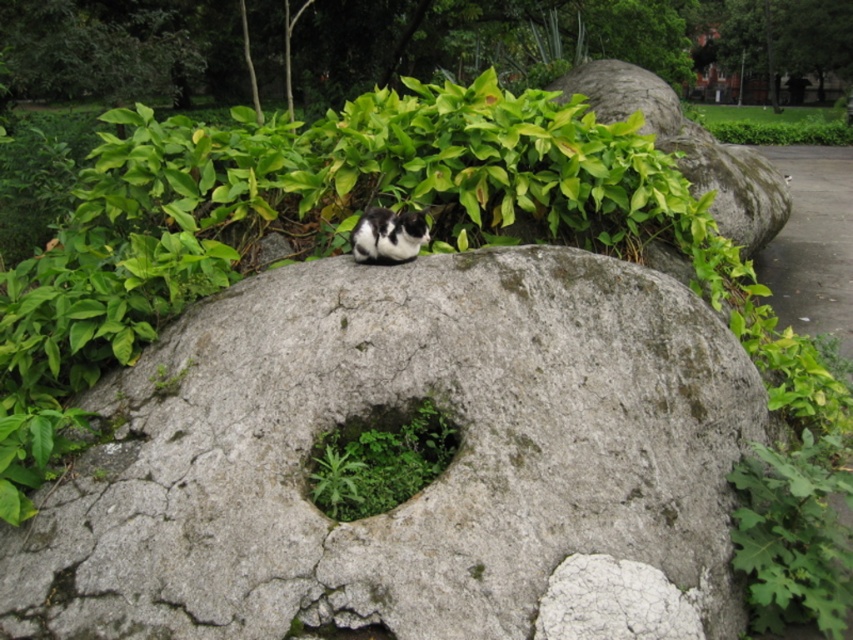
Question: Among these points, which one is farthest from the camera?

Choices:
 (A) 352,436
 (B) 399,224

Answer: (B)

Question: Which is nearer to the gray rough boulder at center?

Choices:
 (A) black-and-white fur cat at center
 (B) green mossy hole at center

Answer: (B)

Question: Is the position of gray rough boulder at center more distant than that of black-and-white fur cat at center?

Choices:
 (A) no
 (B) yes

Answer: (A)

Question: Can you confirm if gray rough boulder at center is positioned above green mossy hole at center?

Choices:
 (A) yes
 (B) no

Answer: (A)

Question: Which object is farther from the camera taking this photo?

Choices:
 (A) black-and-white fur cat at center
 (B) green mossy hole at center

Answer: (A)

Question: Is green mossy hole at center below black-and-white fur cat at center?

Choices:
 (A) yes
 (B) no

Answer: (A)